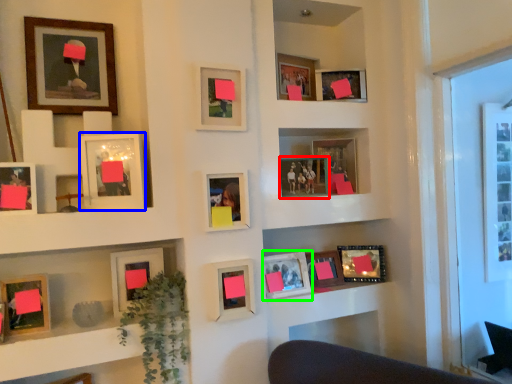
Question: Which object is positioned closest to picture frame (highlighted by a red box)? Select from picture frame (highlighted by a blue box) and picture frame (highlighted by a green box).

Choices:
 (A) picture frame
 (B) picture frame

Answer: (B)